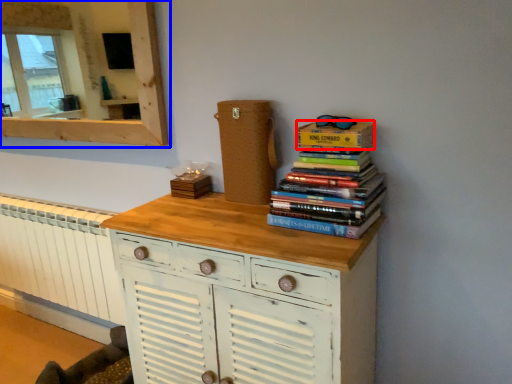
Question: Among these objects, which one is nearest to the camera, paperback book (highlighted by a red box) or medicine cabinet (highlighted by a blue box)?

Choices:
 (A) paperback book
 (B) medicine cabinet

Answer: (A)